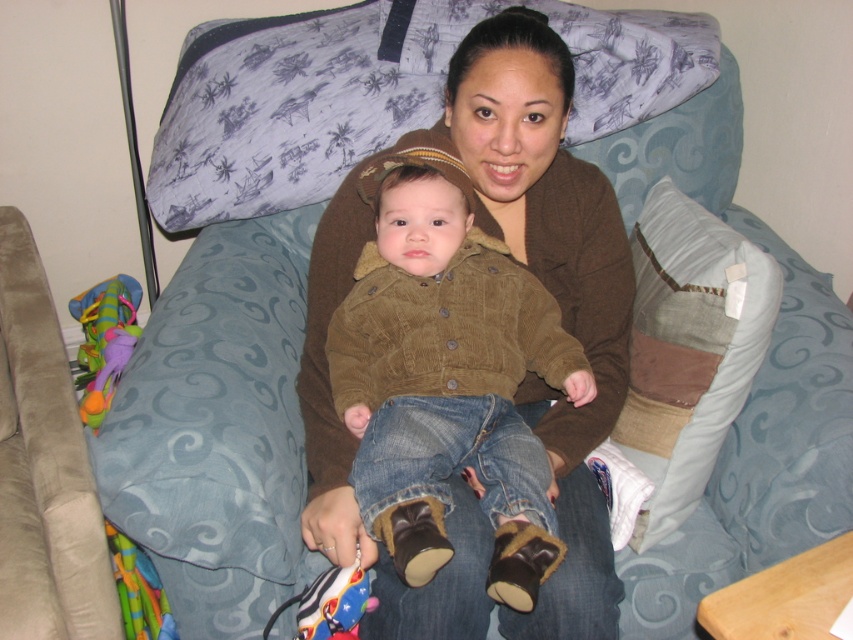
You are a guest in a living room and want to place a small book on the couch between the brown corduroy jacket at center and the patchwork fabric pillow at right. Based on their positions, where should you place the book?

You should place the book to the right of the brown corduroy jacket at center since it is on the left side of the patchwork fabric pillow at right.

You are a photographer trying to capture a closeup of the brown corduroy jacket at center and the patchwork fabric pillow at right. Which object should you focus on first if you want to ensure both are in focus?

The brown corduroy jacket at center is closer to the viewer than the patchwork fabric pillow at right, so focus on the brown corduroy jacket at center first to ensure both are in focus.

You are a toy designer who needs to place a new toy between the brown corduroy jacket at center and the patchwork fabric pillow at right. The toy requires 10 inches of space to fit. Can the toy be placed there?

The brown corduroy jacket at center and the patchwork fabric pillow at right are 10.10 inches apart from each other. Since the required space is 10 inches, the toy can be placed between them as the available space is sufficient.